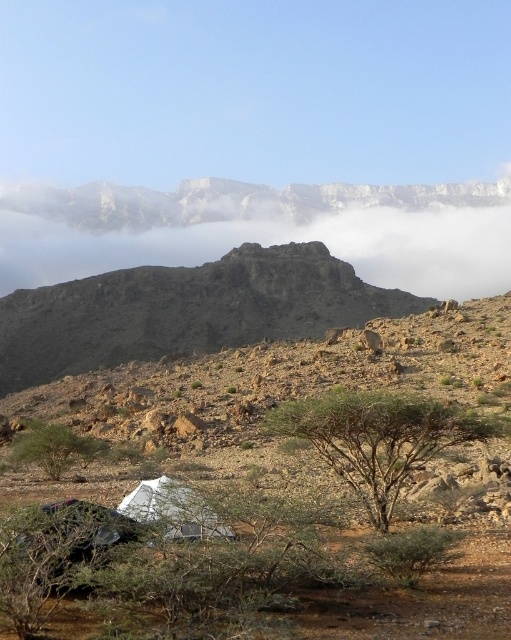
Question: Is the position of white foggy cloud at upper center less distant than that of green leafy tree at center?

Choices:
 (A) no
 (B) yes

Answer: (A)

Question: Which object is farther from the camera taking this photo?

Choices:
 (A) green leafy tree at center
 (B) green leafy tree at lower left

Answer: (B)

Question: Is green leafy tree at center to the right of white fabric tent at lower center from the viewer's perspective?

Choices:
 (A) no
 (B) yes

Answer: (B)

Question: Which point is closer to the camera taking this photo?

Choices:
 (A) (381, 234)
 (B) (148, 516)
 (C) (73, 432)
 (D) (360, 305)

Answer: (B)

Question: Which is farther from the green leafy tree at center?

Choices:
 (A) rugged stone mountain at center
 (B) green leafy tree at lower left
 (C) white foggy cloud at upper center
 (D) white fabric tent at lower center

Answer: (C)

Question: Does white fabric tent at lower center come behind green leafy tree at lower left?

Choices:
 (A) no
 (B) yes

Answer: (A)